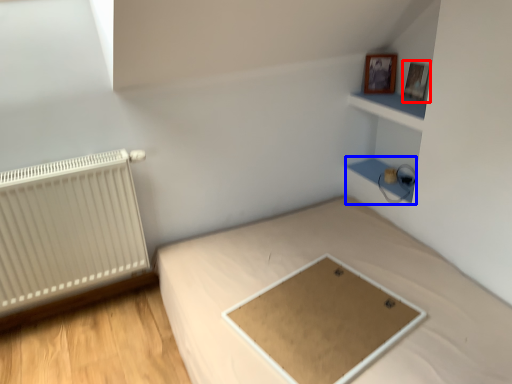
Question: Which point is further to the camera, picture frame (highlighted by a red box) or cabinet (highlighted by a blue box)?

Choices:
 (A) picture frame
 (B) cabinet

Answer: (B)